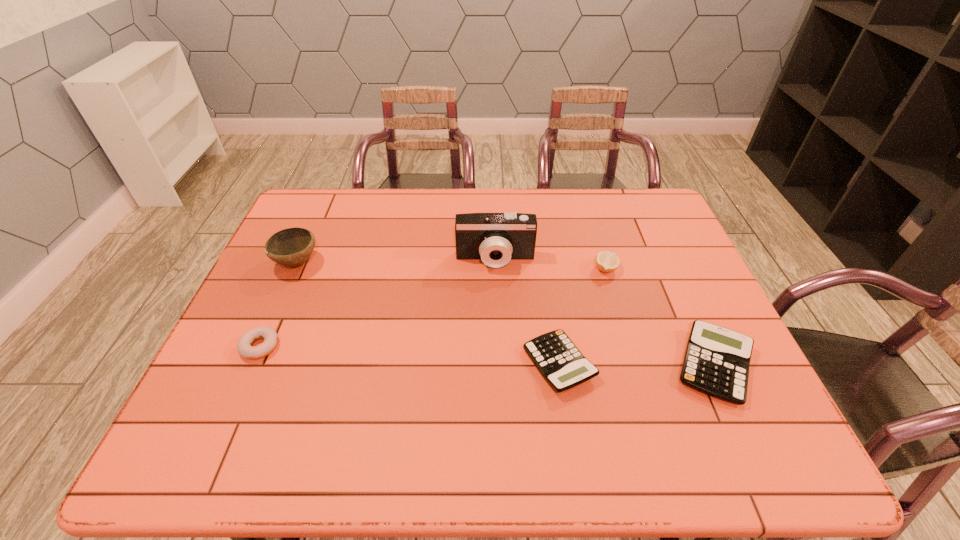
You are a GUI agent. You are given a task and a screenshot of the screen. Output one action in this format:
    pyautogui.click(x=<x>, y=<y>)
    Task: Click on the vacant space at the far left corner of the desktop
    
    Given the screenshot: What is the action you would take?
    pyautogui.click(x=305, y=188)

This screenshot has width=960, height=540. In the image, there is a desktop. Find the location of `vacant space at the near left corner`. vacant space at the near left corner is located at coordinates (256, 402).

Locate an element on the screen. The width and height of the screenshot is (960, 540). free space at the far right corner of the desktop is located at coordinates (644, 221).

Locate an element on the screen. free spot between the doughnut and the rightmost object is located at coordinates (487, 356).

Identify the location of free spot between the lemon and the second tallest object. click(x=451, y=266).

Image resolution: width=960 pixels, height=540 pixels. What are the coordinates of `free space between the rightmost object and the doughnut` in the screenshot? It's located at (487, 356).

Locate an element on the screen. Image resolution: width=960 pixels, height=540 pixels. free space that is in between the fifth object from left to right and the doughnut is located at coordinates (433, 308).

Locate an element on the screen. This screenshot has height=540, width=960. vacant space that is in between the shorter calculator and the doughnut is located at coordinates (410, 355).

At what (x,y) coordinates should I click in order to perform the action: click on free space between the shorter calculator and the doughnut. Please return your answer as a coordinate pair (x, y). The height and width of the screenshot is (540, 960). Looking at the image, I should click on (410, 355).

At what (x,y) coordinates should I click in order to perform the action: click on unoccupied area between the shorter calculator and the camcorder. Please return your answer as a coordinate pair (x, y). Looking at the image, I should click on (527, 312).